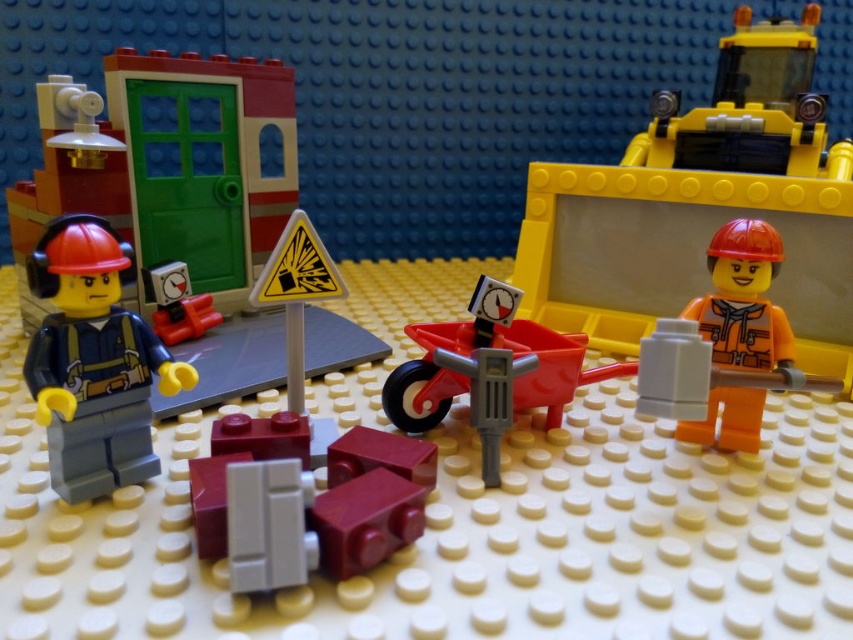
In the LEGO construction scene, there is a smooth red wheelbarrow at center and an orange matte construction worker at right. From the perspective of someone standing at the left side of the scene, which object is closer to the right edge of the image?

The orange matte construction worker at right is closer to the right edge of the image because the smooth red wheelbarrow at center is to the left of the orange matte construction worker at right.